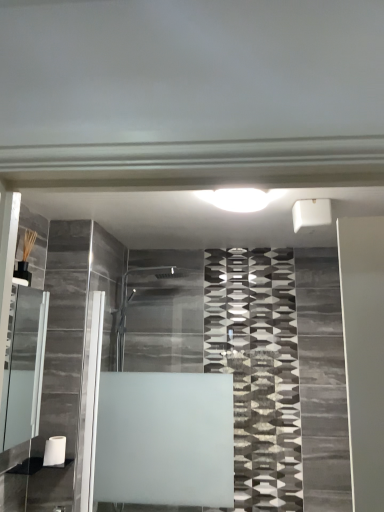
Question: From a real-world perspective, is frosted glass shower door at center physically located above or below white glossy light at center?

Choices:
 (A) above
 (B) below

Answer: (B)

Question: From the image's perspective, relative to white glossy light at center, is frosted glass shower door at center above or below?

Choices:
 (A) above
 (B) below

Answer: (B)

Question: Estimate the real-world distances between objects in this image. Which object is closer to the matte glass cabinet at left?

Choices:
 (A) frosted glass shower door at center
 (B) white matte toilet paper at lower left
 (C) white glossy light at center

Answer: (B)

Question: Which object is the farthest from the frosted glass shower door at center?

Choices:
 (A) white glossy light at center
 (B) matte glass cabinet at left
 (C) white matte toilet paper at lower left

Answer: (A)